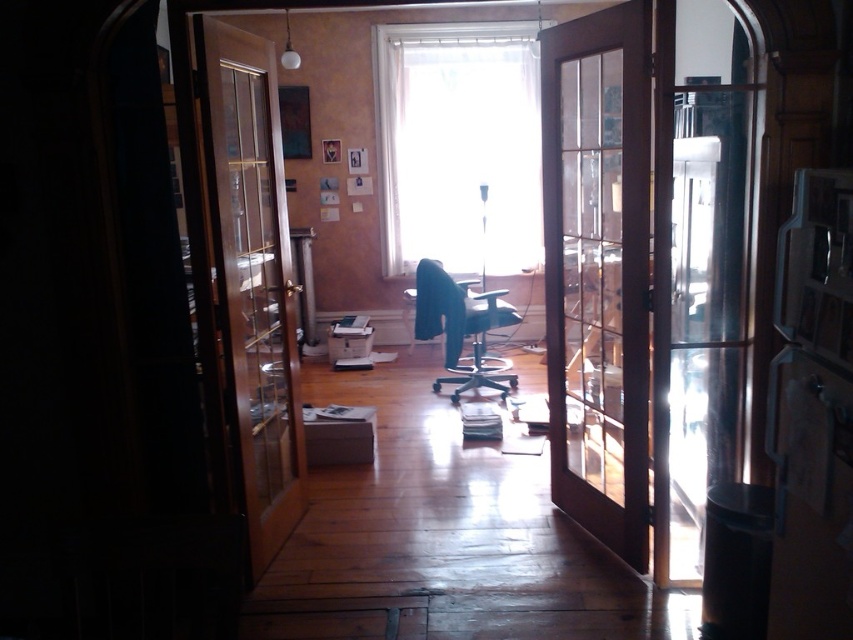
You are standing in the hallway outside the wooden door at left. You need to reach the satin silver refrigerator at right, which is 5.5 feet away from you. Can you walk straight to it without going through the door?

The wooden door at left is 5.41 feet away from the satin silver refrigerator at right. Since you are outside the wooden door at left and the refrigerator is 5.5 feet away from you, you cannot walk straight to the refrigerator without going through the door because the distance through the door is shorter and the path is blocked by the door itself.

In the scene shown: You are standing in a hallway and see the brown wooden screen door at center and the satin silver refrigerator at right. Which object is closer to you?

The brown wooden screen door at center is closer to you because it is positioned over the satin silver refrigerator at right, indicating it is in front.